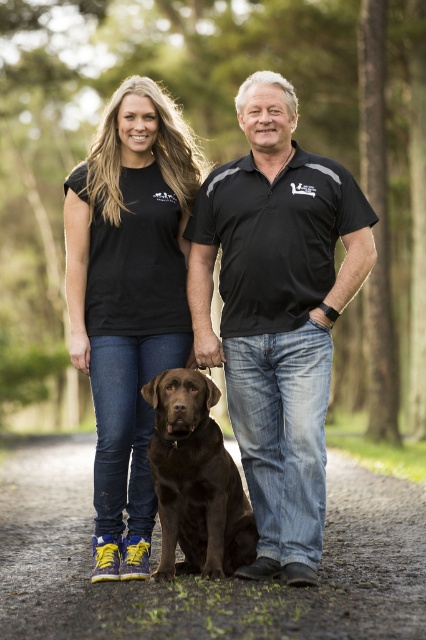
Question: Can you confirm if black matte t-shirt at center is positioned to the left of shiny brown dog at center?

Choices:
 (A) yes
 (B) no

Answer: (A)

Question: Which of the following is the closest to the observer?

Choices:
 (A) (17, 472)
 (B) (204, 422)

Answer: (B)

Question: Estimate the real-world distances between objects in this image. Which object is farther from the black cotton polo shirt at center?

Choices:
 (A) dirt path at center
 (B) shiny brown dog at center
 (C) black matte t-shirt at center

Answer: (A)

Question: Based on their relative distances, which object is farther from the black matte t-shirt at center?

Choices:
 (A) shiny brown dog at center
 (B) dirt path at center

Answer: (B)

Question: Can you confirm if black cotton polo shirt at center is thinner than black matte t-shirt at center?

Choices:
 (A) yes
 (B) no

Answer: (B)

Question: Does black cotton polo shirt at center appear on the left side of black matte t-shirt at center?

Choices:
 (A) no
 (B) yes

Answer: (A)